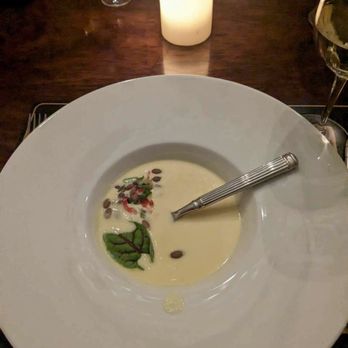
You are a GUI agent. You are given a task and a screenshot of the screen. Output one action in this format:
    pyautogui.click(x=<x>, y=<y>)
    Task: Click on the wine glass
    The image size is (348, 348).
    Given the screenshot: What is the action you would take?
    pyautogui.click(x=328, y=50)